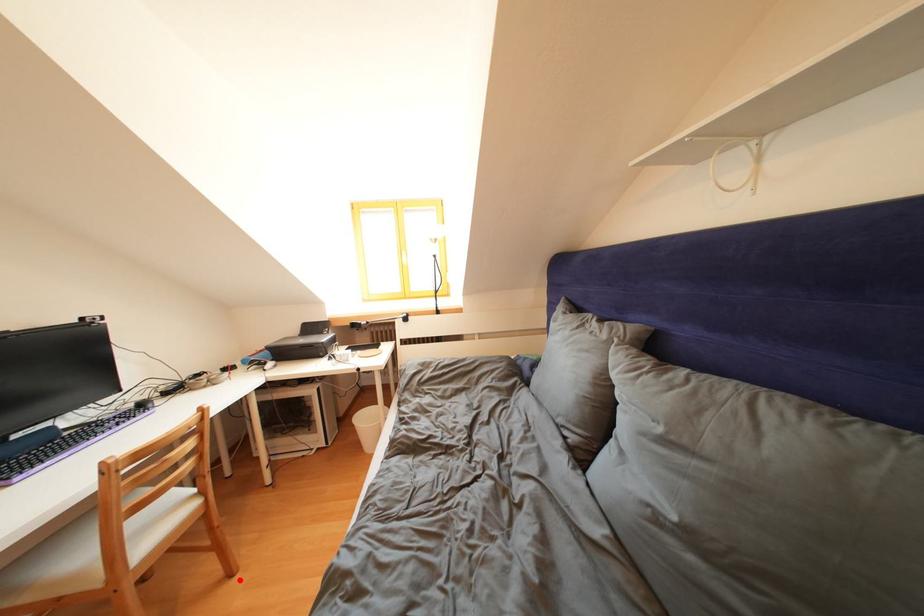
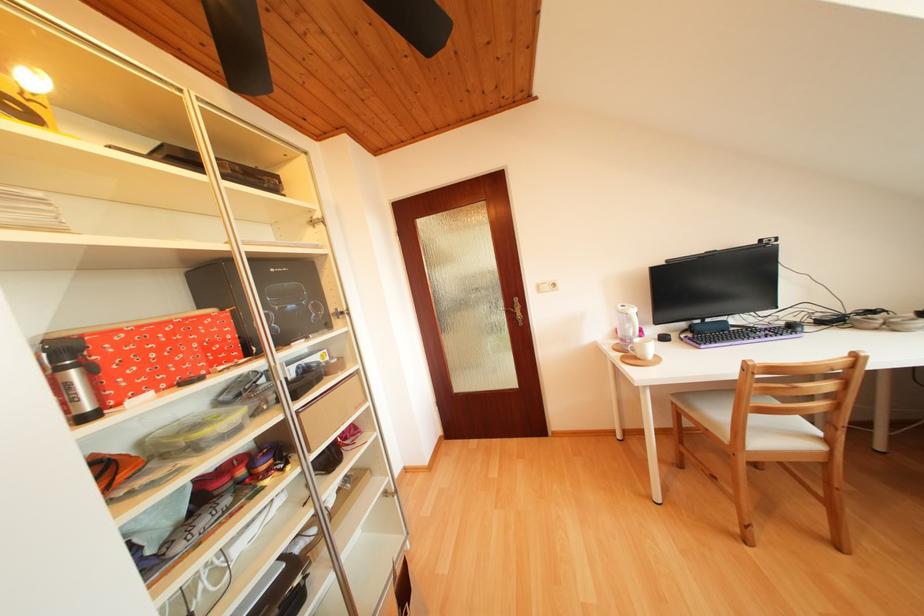
Question: I am providing you with two images of the same scene from different viewpoints. A red point is shown in image1. For the corresponding object point in image2, is it positioned nearer or farther from the camera?

Choices:
 (A) Nearer
 (B) Farther

Answer: (B)